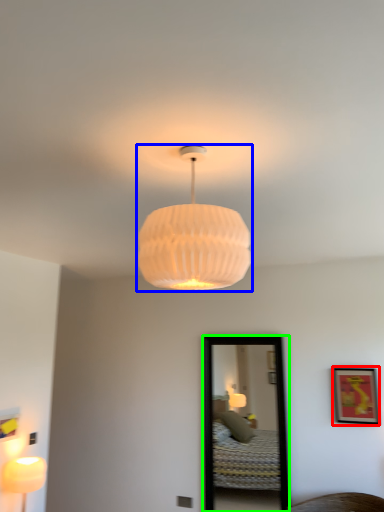
Question: Considering the real-world distances, which object is closest to picture frame (highlighted by a red box)? lamp (highlighted by a blue box) or mirror (highlighted by a green box).

Choices:
 (A) lamp
 (B) mirror

Answer: (B)